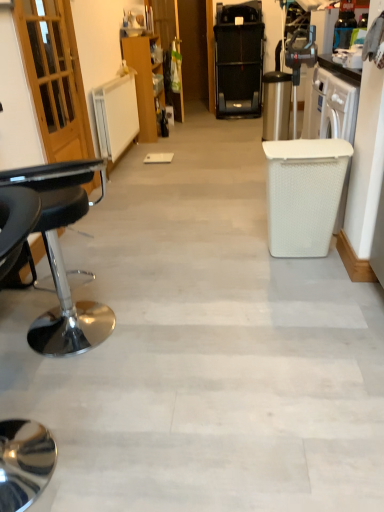
Question: Looking at their shapes, would you say wooden cabinet at center is wider or thinner than black plastic treadmill at upper center?

Choices:
 (A) wide
 (B) thin

Answer: (B)

Question: Is wooden cabinet at center to the left or to the right of black plastic treadmill at upper center in the image?

Choices:
 (A) left
 (B) right

Answer: (A)

Question: Which object is positioned closest to the black plastic treadmill at upper center?

Choices:
 (A) wooden cabinet at center
 (B) black leather stool at left

Answer: (A)

Question: Which object is positioned farthest from the wooden cabinet at center?

Choices:
 (A) black leather stool at left
 (B) black plastic treadmill at upper center

Answer: (A)